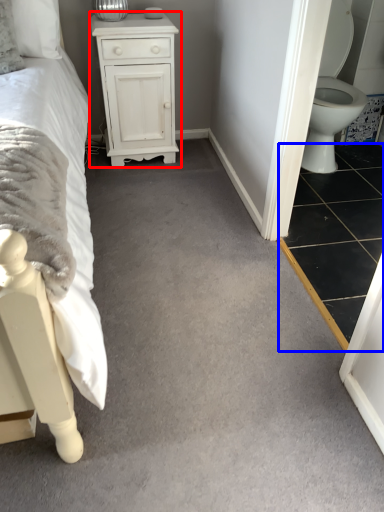
Question: Which object is further to the camera taking this photo, chest of drawers (highlighted by a red box) or tile (highlighted by a blue box)?

Choices:
 (A) chest of drawers
 (B) tile

Answer: (A)